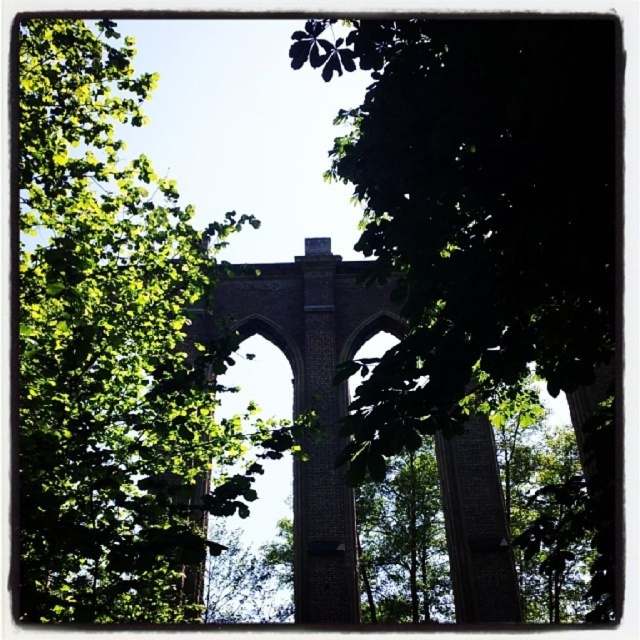
Question: Which of the following is the closest to the observer?

Choices:
 (A) green leafy tree at center
 (B) green leafy tree at left

Answer: (A)

Question: Which object is farther from the camera taking this photo?

Choices:
 (A) green leafy tree at left
 (B) green leafy tree at center

Answer: (A)

Question: Which point is farther from the camera taking this photo?

Choices:
 (A) (588, 38)
 (B) (61, 115)

Answer: (B)

Question: Is green leafy tree at center further to camera compared to green leafy tree at left?

Choices:
 (A) no
 (B) yes

Answer: (A)

Question: Is the position of green leafy tree at center more distant than that of green leafy tree at left?

Choices:
 (A) no
 (B) yes

Answer: (A)

Question: Is the position of green leafy tree at center less distant than that of green leafy tree at left?

Choices:
 (A) yes
 (B) no

Answer: (A)